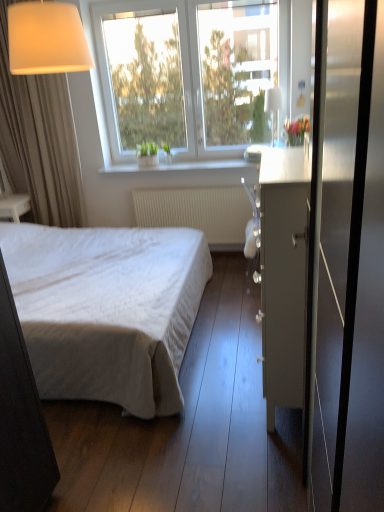
Question: From the image's perspective, is white smooth window sill at upper center on metallic glass screen door at right?

Choices:
 (A) yes
 (B) no

Answer: (A)

Question: From the image's perspective, is white smooth window sill at upper center under metallic glass screen door at right?

Choices:
 (A) yes
 (B) no

Answer: (B)

Question: From a real-world perspective, is white smooth window sill at upper center located beneath metallic glass screen door at right?

Choices:
 (A) no
 (B) yes

Answer: (B)

Question: Does white smooth window sill at upper center have a greater height compared to metallic glass screen door at right?

Choices:
 (A) no
 (B) yes

Answer: (A)

Question: Would you say metallic glass screen door at right is part of white smooth window sill at upper center's contents?

Choices:
 (A) no
 (B) yes

Answer: (A)

Question: Does white smooth window sill at upper center have a lesser height compared to metallic glass screen door at right?

Choices:
 (A) yes
 (B) no

Answer: (A)

Question: Does metallic glass screen door at right have a greater width compared to white textured radiator at center?

Choices:
 (A) yes
 (B) no

Answer: (B)

Question: Is metallic glass screen door at right smaller than white textured radiator at center?

Choices:
 (A) yes
 (B) no

Answer: (B)

Question: Is metallic glass screen door at right not within white textured radiator at center?

Choices:
 (A) yes
 (B) no

Answer: (A)

Question: Can you confirm if metallic glass screen door at right is positioned to the right of white textured radiator at center?

Choices:
 (A) yes
 (B) no

Answer: (A)

Question: Is metallic glass screen door at right in contact with white textured radiator at center?

Choices:
 (A) yes
 (B) no

Answer: (B)

Question: From the image's perspective, is metallic glass screen door at right under white textured radiator at center?

Choices:
 (A) yes
 (B) no

Answer: (A)

Question: Considering the relative sizes of matte gray cabinet at center-right and transparent glass window at upper center in the image provided, is matte gray cabinet at center-right taller than transparent glass window at upper center?

Choices:
 (A) no
 (B) yes

Answer: (A)